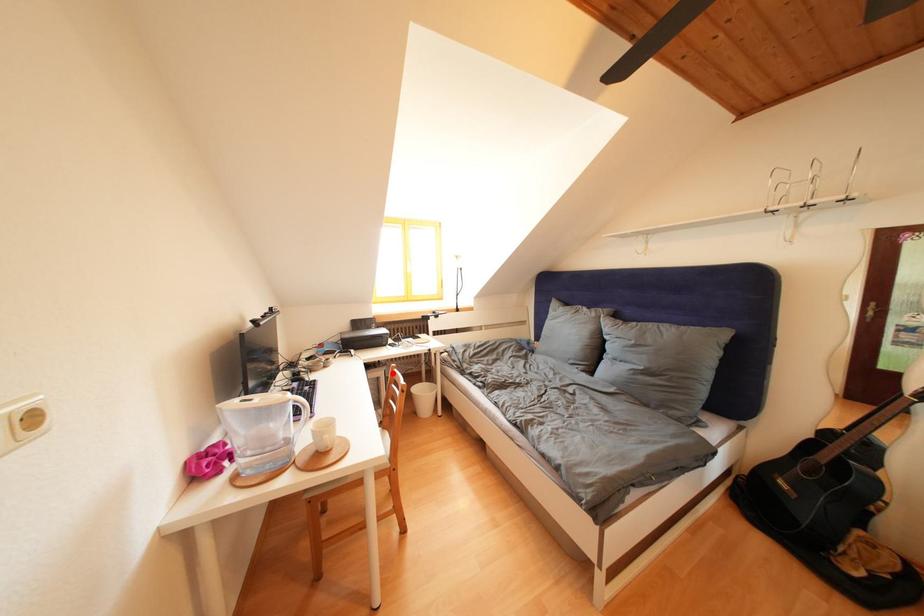
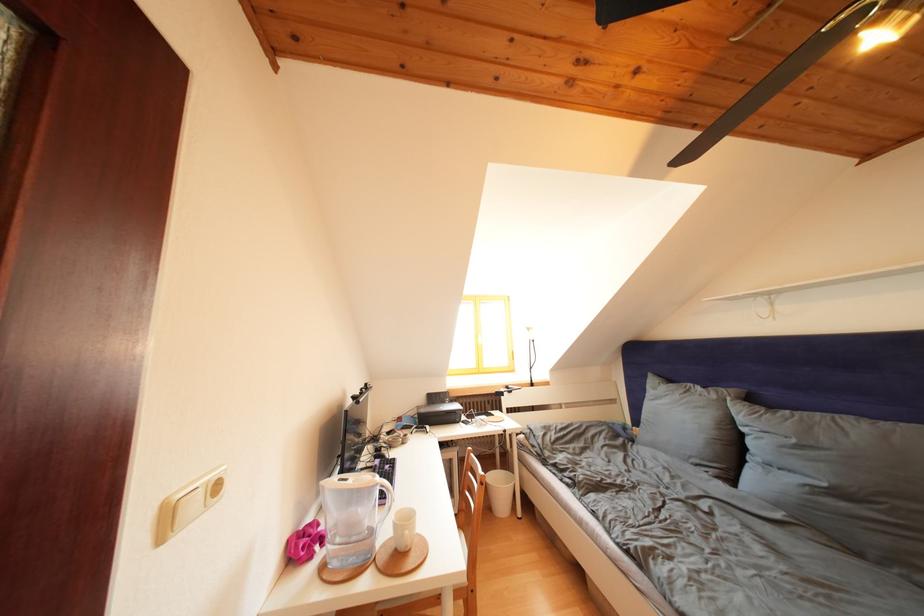
Question: I am providing you with two images of the same scene from different viewpoints. Given a red point in image1, look at the same physical point in image2. Is it:

Choices:
 (A) Closer to the viewpoint
 (B) Farther from the viewpoint

Answer: (B)